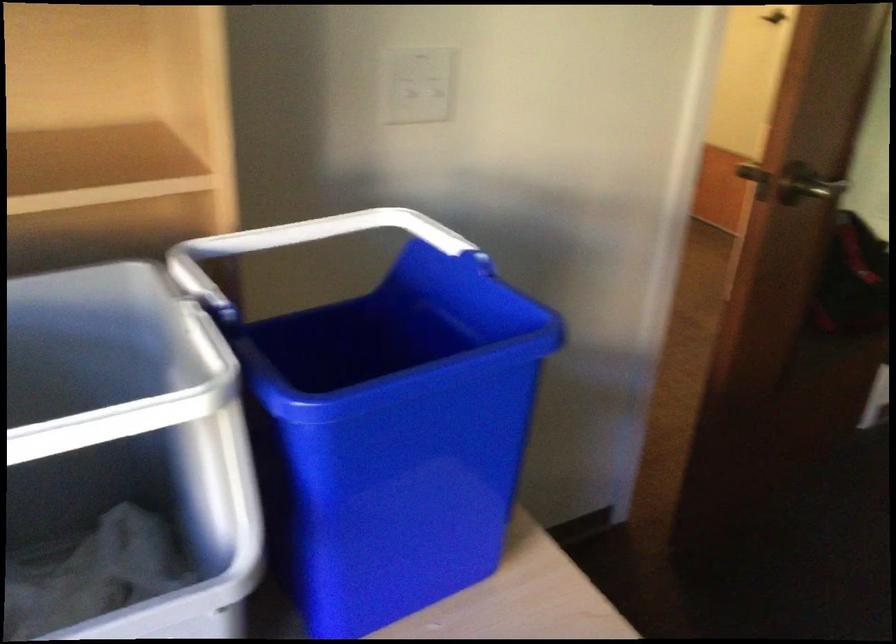
Image resolution: width=896 pixels, height=644 pixels. I want to click on metal door handle, so click(x=803, y=192).